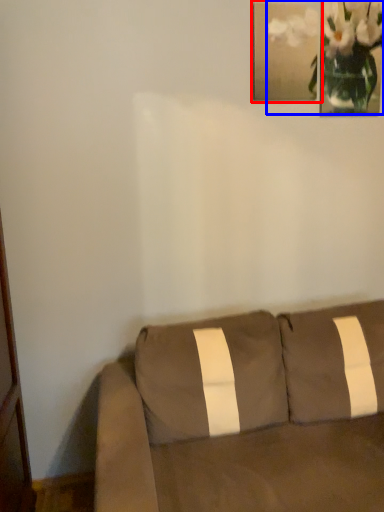
Question: Which point is closer to the camera, picture frame (highlighted by a red box) or floral arrangement (highlighted by a blue box)?

Choices:
 (A) picture frame
 (B) floral arrangement

Answer: (A)